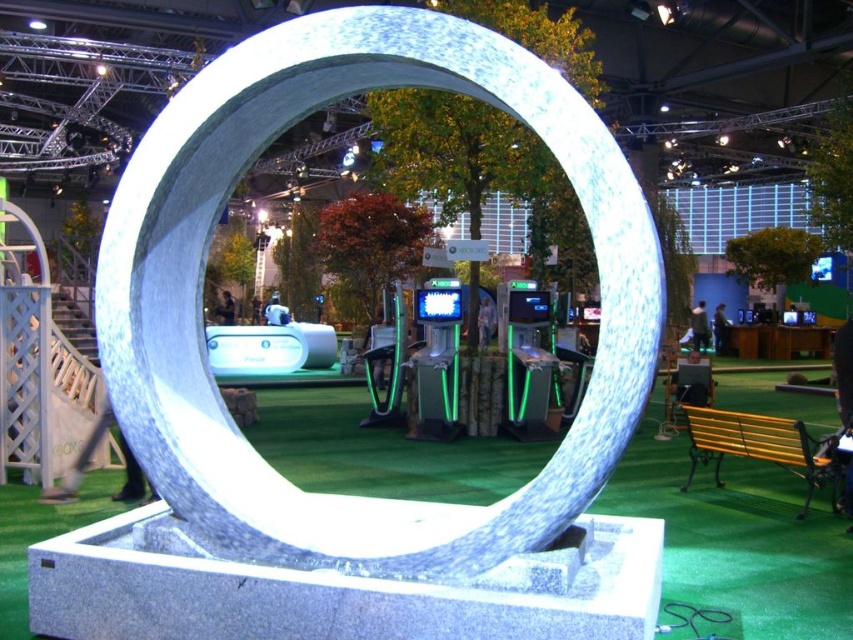
You are an event planner assessing the layout of the exhibition space. You need to place a 3m wide banner between the white marble ring at center and the green artificial turf at center. Based on their widths, will the banner fit between them?

The white marble ring at center has a lesser width compared to green artificial turf at center. Since the banner is 3m wide, it can fit between them if the distance between the two objects is sufficient. However, the question only provides information about their widths, not the distance between them. Therefore, we cannot determine if the banner will fit based solely on the given information.

You are a visitor at the exhibition and want to walk from the white marble ring at center to the green artificial turf at center. How much space do you need to navigate between them?

The white marble ring at center and green artificial turf at center are 2.49 meters apart, so you need at least 2.49 meters of space to navigate between them.

You are at the exhibition and want to take a photo of both the white marble ring at center and the green artificial turf at center. Since they are both at the center, how can you position yourself to capture both in the frame?

The white marble ring at center is in front of the green artificial turf at center, so you should position yourself behind the green artificial turf at center to ensure both the white marble ring at center and the green artificial turf at center are visible in the frame.